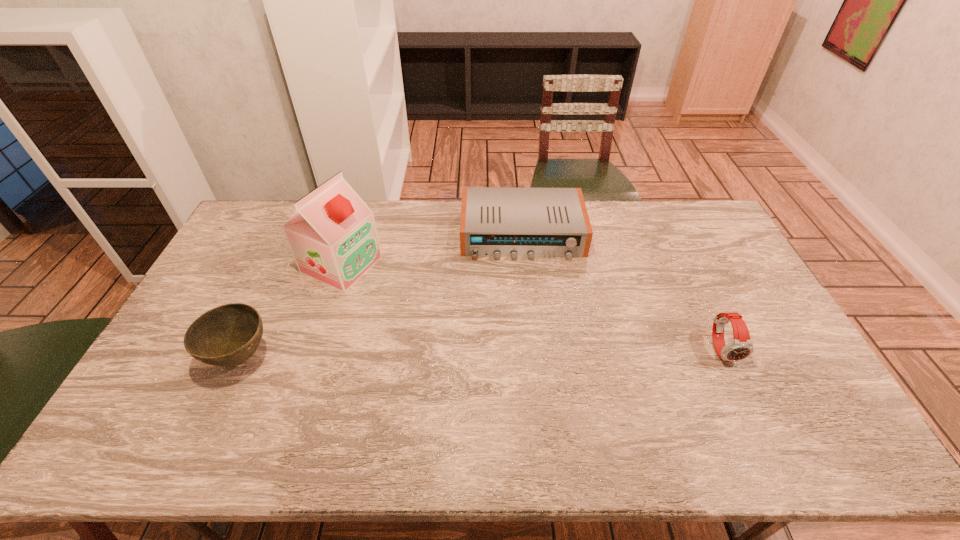
This screenshot has width=960, height=540. I want to click on bowl, so click(228, 335).

Locate an element on the screen. The height and width of the screenshot is (540, 960). the rightmost object is located at coordinates (741, 347).

Image resolution: width=960 pixels, height=540 pixels. Find the location of `the tallest object`. the tallest object is located at coordinates (332, 235).

Where is `the third object from left to right`? the third object from left to right is located at coordinates (496, 222).

Where is `the shortest object`? The width and height of the screenshot is (960, 540). the shortest object is located at coordinates (496, 222).

Find the location of `vacant area situated 0.290m on the back of the bowl`. vacant area situated 0.290m on the back of the bowl is located at coordinates (283, 264).

You are a GUI agent. You are given a task and a screenshot of the screen. Output one action in this format:
    pyautogui.click(x=<x>, y=<y>)
    Task: Click on the free region located 0.050m on the face of the watch
    This screenshot has width=960, height=540.
    Given the screenshot: What is the action you would take?
    pyautogui.click(x=738, y=383)

This screenshot has height=540, width=960. Identify the location of free space located 0.190m with the cap open on the soya milk. (420, 298).

Locate an element on the screen. free space located with the cap open on the soya milk is located at coordinates (453, 312).

Identify the location of blank area located 0.230m with the cap open on the soya milk. This screenshot has height=540, width=960. (431, 303).